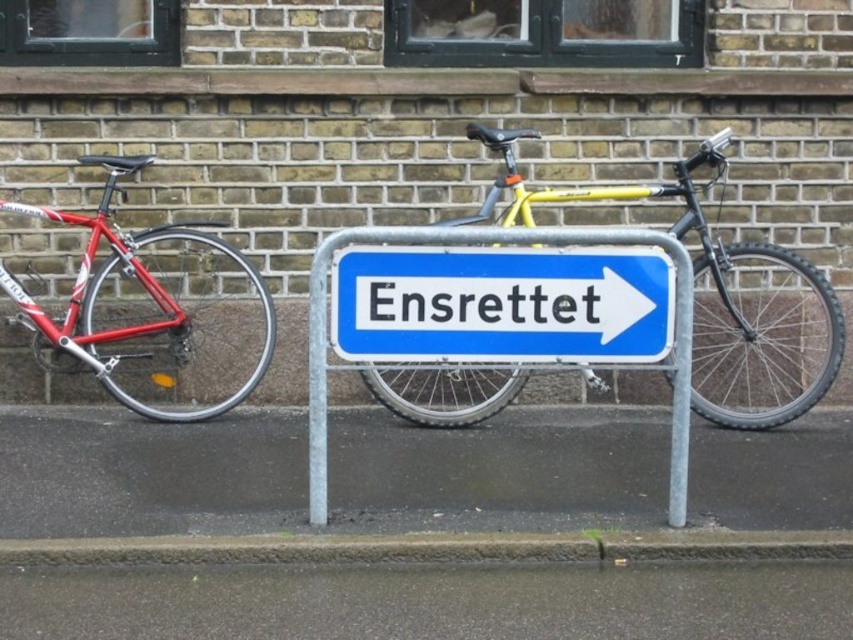
Is shiny red bicycle at left behind yellow matte bicycle at center?

Yes, shiny red bicycle at left is behind yellow matte bicycle at center.

Is shiny red bicycle at left above yellow matte bicycle at center?

Actually, shiny red bicycle at left is below yellow matte bicycle at center.

The image size is (853, 640). What do you see at coordinates (154, 310) in the screenshot?
I see `shiny red bicycle at left` at bounding box center [154, 310].

Find the location of `shiny red bicycle at left`. shiny red bicycle at left is located at coordinates (154, 310).

Which is more to the left, yellow matte bicycle at center or blue metallic sign at center?

Positioned to the left is blue metallic sign at center.

Can you confirm if yellow matte bicycle at center is taller than blue metallic sign at center?

Indeed, yellow matte bicycle at center has a greater height compared to blue metallic sign at center.

Between point (724, 316) and point (436, 284), which one is positioned in front?

Point (436, 284)

Find the location of `yellow matte bicycle at center`. yellow matte bicycle at center is located at coordinates (718, 296).

Does shiny red bicycle at left appear on the left side of blue metallic sign at center?

Correct, you'll find shiny red bicycle at left to the left of blue metallic sign at center.

Which is in front, point (212, 378) or point (602, 337)?

Positioned in front is point (602, 337).

I want to click on shiny red bicycle at left, so click(154, 310).

Find the location of a particular element. Image resolution: width=853 pixels, height=640 pixels. shiny red bicycle at left is located at coordinates (154, 310).